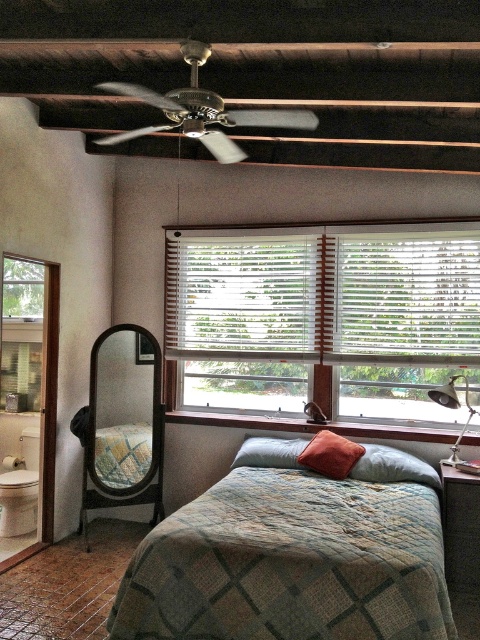
Question: Can you confirm if velvet orange pillow at center is smaller than textured blue pillow at center?

Choices:
 (A) no
 (B) yes

Answer: (B)

Question: Is white wood blinds at center bigger than white matte blinds at center?

Choices:
 (A) no
 (B) yes

Answer: (B)

Question: Which of the following is the farthest from the observer?

Choices:
 (A) white wood blinds at center
 (B) metallic silver desk lamp at right
 (C) velvet orange pillow at center
 (D) velvet red pillow at center

Answer: (A)

Question: Which object is the closest to the white matte blinds at center?

Choices:
 (A) textured green quilt at center
 (B) white wood blinds at center
 (C) textured blue pillow at center

Answer: (B)

Question: Which is farther from the textured blue pillow at center?

Choices:
 (A) metallic silver desk lamp at right
 (B) white wood blinds at center
 (C) textured green quilt at center

Answer: (A)

Question: Is metallic ceiling fan at upper center in front of velvet orange pillow at center?

Choices:
 (A) yes
 (B) no

Answer: (A)